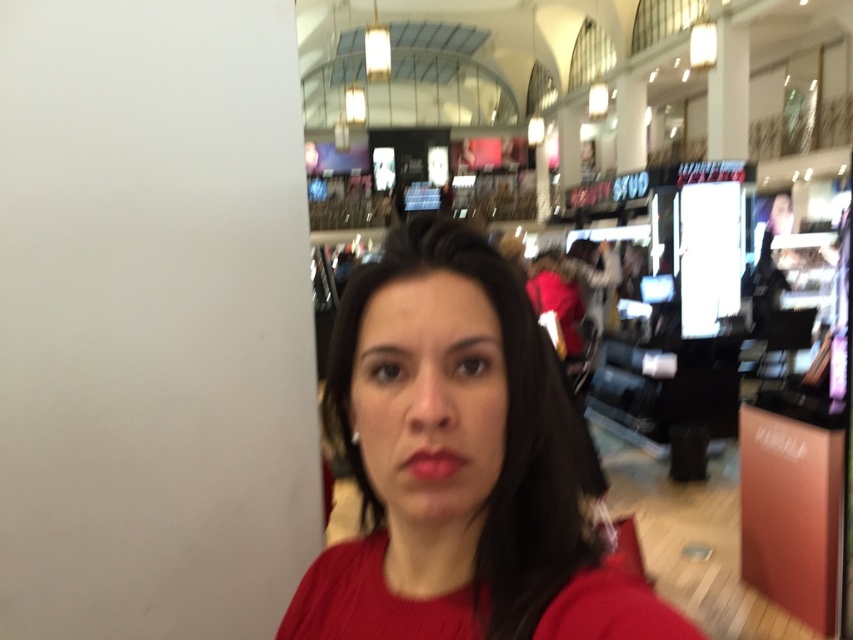
Who is more distant from viewer, (393, 451) or (457, 461)?

Point (393, 451)

Who is positioned more to the left, matte red sweater at center or matte red lipstick at center?

matte red lipstick at center is more to the left.

Between point (398, 516) and point (459, 460), which one is positioned in front?

Positioned in front is point (459, 460).

At what (x,y) coordinates should I click in order to perform the action: click on matte red sweater at center. Please return your answer as a coordinate pair (x, y). This screenshot has width=853, height=640. Looking at the image, I should click on 463,467.